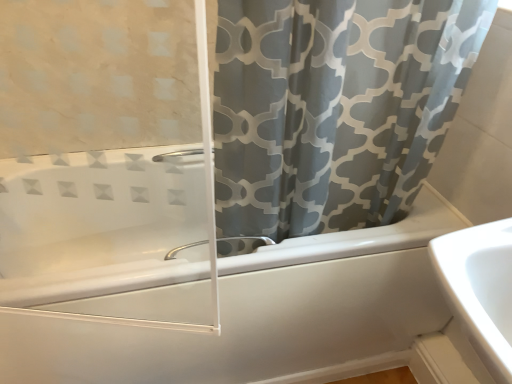
What is the approximate height of white glossy bathtub at center?

white glossy bathtub at center is 19.98 inches in height.

Image resolution: width=512 pixels, height=384 pixels. Describe the element at coordinates (183, 249) in the screenshot. I see `satin nickel faucet at lower center` at that location.

This screenshot has width=512, height=384. I want to click on gray fabric curtain at upper right, so click(x=334, y=108).

Is point (176, 381) behind point (260, 58)?

Yes, point (176, 381) is farther from viewer.

Which of these two, white glossy bathtub at center or gray fabric curtain at upper right, is bigger?

Bigger between the two is white glossy bathtub at center.

Which object is closer to the camera taking this photo, white glossy bathtub at center or gray fabric curtain at upper right?

gray fabric curtain at upper right.

Does satin nickel faucet at lower center contain white glossy bathtub at center?

No, white glossy bathtub at center is not surrounded by satin nickel faucet at lower center.

Consider the image. Would you consider satin nickel faucet at lower center to be distant from white glossy bathtub at center?

Actually, satin nickel faucet at lower center and white glossy bathtub at center are a little close together.

Considering the relative sizes of satin nickel faucet at lower center and white glossy bathtub at center in the image provided, is satin nickel faucet at lower center taller than white glossy bathtub at center?

Incorrect, the height of satin nickel faucet at lower center is not larger of that of white glossy bathtub at center.

From a real-world perspective, is satin nickel faucet at lower center physically below white glossy bathtub at center?

No, from a real-world perspective, satin nickel faucet at lower center is not beneath white glossy bathtub at center.

Which of these two, gray fabric curtain at upper right or satin nickel faucet at lower center, is smaller?

With smaller size is satin nickel faucet at lower center.

Is gray fabric curtain at upper right with satin nickel faucet at lower center?

No.

How much distance is there between gray fabric curtain at upper right and satin nickel faucet at lower center?

The distance of gray fabric curtain at upper right from satin nickel faucet at lower center is 14.44 inches.

Is point (217, 240) closer or farther from the camera than point (475, 55)?

Point (217, 240) appears to be farther away from the viewer than point (475, 55).

How different are the orientations of satin nickel faucet at lower center and gray fabric curtain at upper right in degrees?

The angle between the facing direction of satin nickel faucet at lower center and the facing direction of gray fabric curtain at upper right is 179 degrees.

Can you confirm if satin nickel faucet at lower center is taller than gray fabric curtain at upper right?

No, satin nickel faucet at lower center is not taller than gray fabric curtain at upper right.

Would you say satin nickel faucet at lower center is outside gray fabric curtain at upper right?

No.

From the image's perspective, between gray fabric curtain at upper right and white glossy bathtub at center, who is located below?

From the image's view, white glossy bathtub at center is below.

In the scene shown: What's the angular difference between gray fabric curtain at upper right and white glossy bathtub at center's facing directions?

The facing directions of gray fabric curtain at upper right and white glossy bathtub at center are 0.263 degrees apart.

Between gray fabric curtain at upper right and white glossy bathtub at center, which one has more height?

gray fabric curtain at upper right.

In the image, is white glossy bathtub at center positioned in front of or behind satin nickel faucet at lower center?

white glossy bathtub at center is in front of satin nickel faucet at lower center.

Considering the relative sizes of white glossy bathtub at center and satin nickel faucet at lower center in the image provided, is white glossy bathtub at center thinner than satin nickel faucet at lower center?

No.

Is satin nickel faucet at lower center inside white glossy bathtub at center?

Yes, white glossy bathtub at center contains satin nickel faucet at lower center.

This screenshot has height=384, width=512. I want to click on bathtub below the gray fabric curtain at upper right (from the image's perspective), so click(x=263, y=313).

At what (x,y) coordinates should I click in order to perform the action: click on tap that appears above the white glossy bathtub at center (from a real-world perspective). Please return your answer as a coordinate pair (x, y). The image size is (512, 384). Looking at the image, I should click on (183, 249).

Estimate the real-world distances between objects in this image. Which object is closer to gray fabric curtain at upper right, white glossy bathtub at center or satin nickel faucet at lower center?

white glossy bathtub at center.

In the scene shown: Which object lies further to the anchor point white glossy bathtub at center, satin nickel faucet at lower center or gray fabric curtain at upper right?

gray fabric curtain at upper right lies further to white glossy bathtub at center than the other object.

Which object lies further to the anchor point gray fabric curtain at upper right, satin nickel faucet at lower center or white glossy bathtub at center?

The object further to gray fabric curtain at upper right is satin nickel faucet at lower center.

Which object lies further to the anchor point satin nickel faucet at lower center, white glossy bathtub at center or gray fabric curtain at upper right?

Among the two, gray fabric curtain at upper right is located further to satin nickel faucet at lower center.

Considering their positions, is gray fabric curtain at upper right positioned closer to white glossy bathtub at center than satin nickel faucet at lower center?

satin nickel faucet at lower center is positioned closer to the anchor white glossy bathtub at center.

From the image, which object appears to be farther from satin nickel faucet at lower center, gray fabric curtain at upper right or white glossy bathtub at center?

Among the two, gray fabric curtain at upper right is located further to satin nickel faucet at lower center.

Identify the location of tap situated between white glossy bathtub at center and gray fabric curtain at upper right from left to right. The height and width of the screenshot is (384, 512). (183, 249).